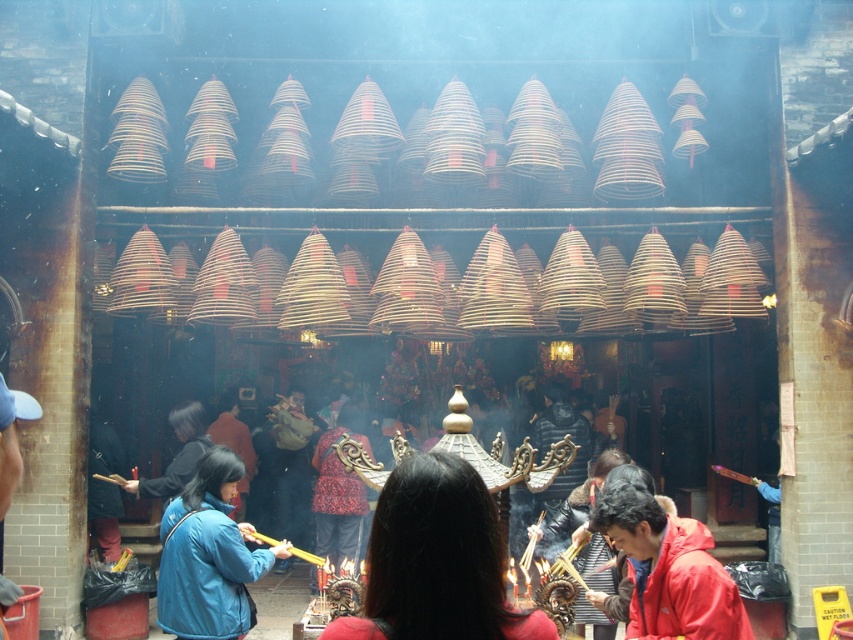
Question: Can you confirm if red matte jacket at center is smaller than red patterned fabric at center?

Choices:
 (A) no
 (B) yes

Answer: (B)

Question: Does blue fabric robe at lower left have a greater width compared to red patterned fabric at center?

Choices:
 (A) yes
 (B) no

Answer: (A)

Question: Estimate the real-world distances between objects in this image. Which object is closer to the red patterned fabric at center?

Choices:
 (A) red matte jacket at lower right
 (B) red matte jacket at center

Answer: (A)

Question: Is blue fabric robe at lower left further to the viewer compared to red patterned fabric at center?

Choices:
 (A) yes
 (B) no

Answer: (B)

Question: Which object is farther from the camera taking this photo?

Choices:
 (A) red matte jacket at center
 (B) red matte jacket at lower right

Answer: (B)

Question: Which object is positioned farthest from the red matte jacket at lower right?

Choices:
 (A) blue fabric robe at lower left
 (B) red patterned fabric at center
 (C) red matte jacket at center

Answer: (B)